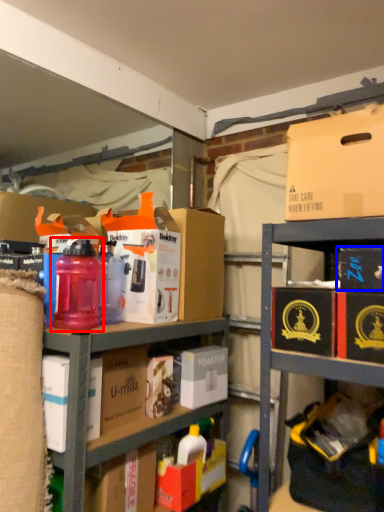
Question: Which point is further to the camera, bottle (highlighted by a red box) or storage box (highlighted by a blue box)?

Choices:
 (A) bottle
 (B) storage box

Answer: (A)